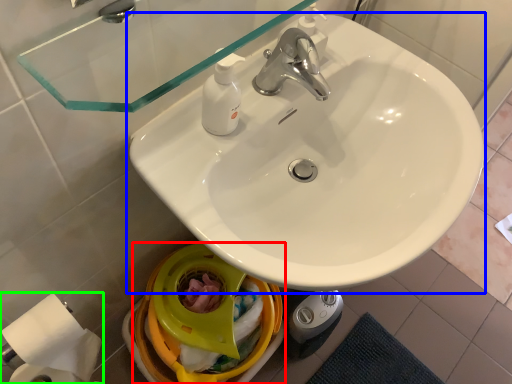
Question: Which is farther away from bidet (highlighted by a red box)? sink (highlighted by a blue box) or toilet paper (highlighted by a green box)?

Choices:
 (A) sink
 (B) toilet paper

Answer: (A)